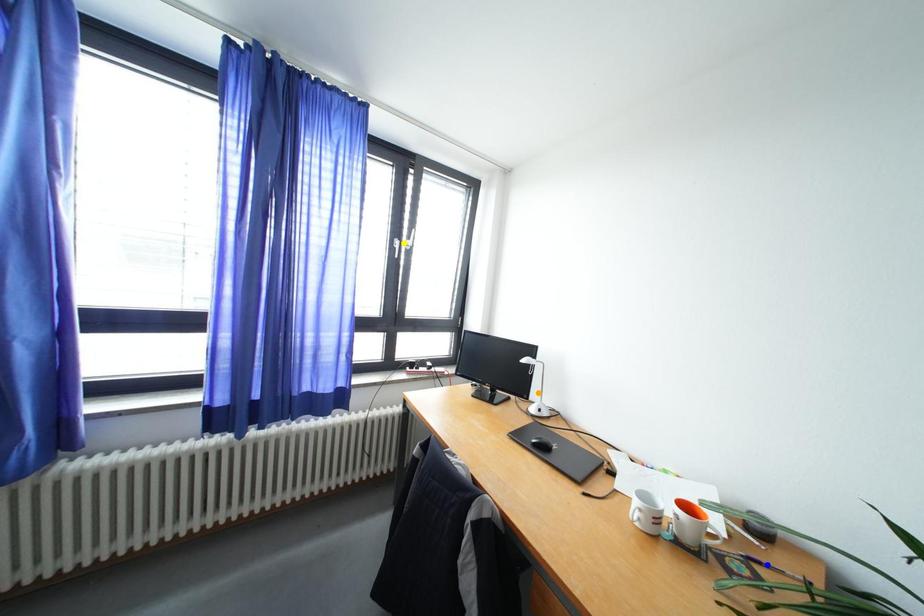
Order these from nearest to farthest:
orange point, blue point, yellow point

blue point, orange point, yellow point